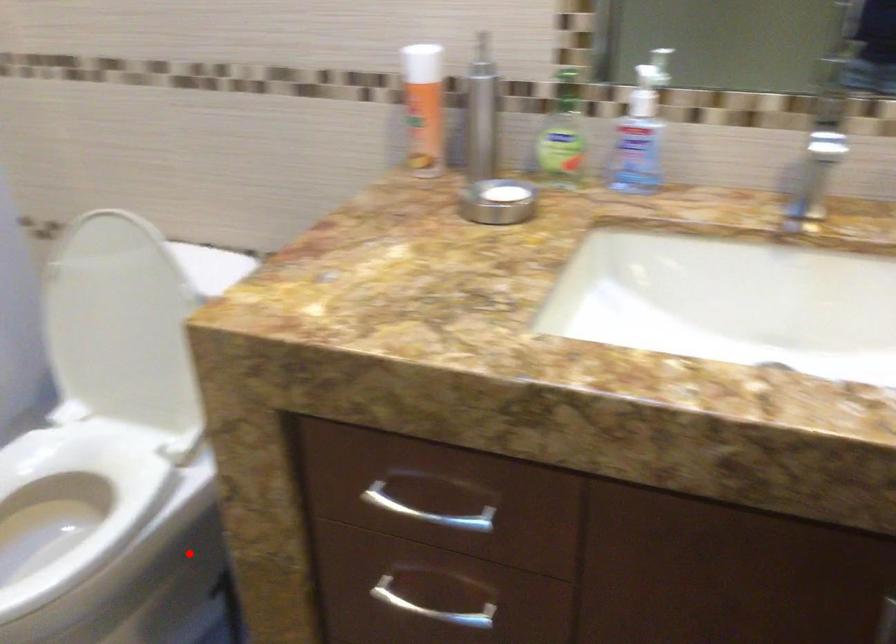
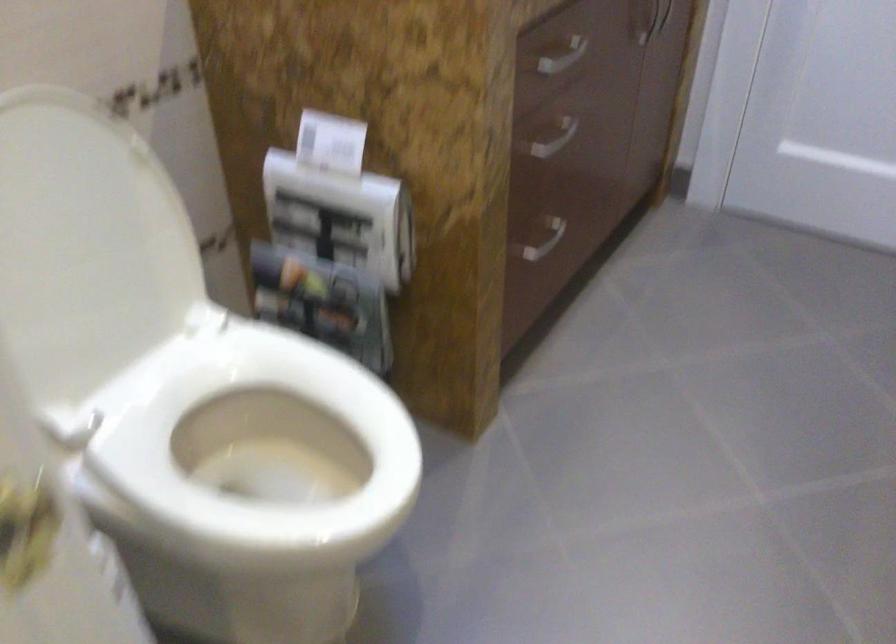
Question: I am providing you with two images of the same scene from different viewpoints. Given a red point in image1, look at the same physical point in image2. Is it:

Choices:
 (A) Closer to the viewpoint
 (B) Farther from the viewpoint

Answer: (A)